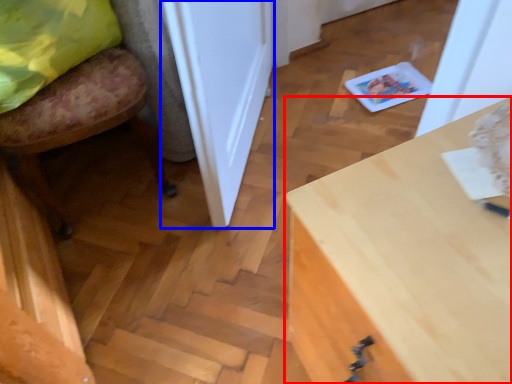
Question: Which object appears closest to the camera in this image, desk (highlighted by a red box) or door (highlighted by a blue box)?

Choices:
 (A) desk
 (B) door

Answer: (A)